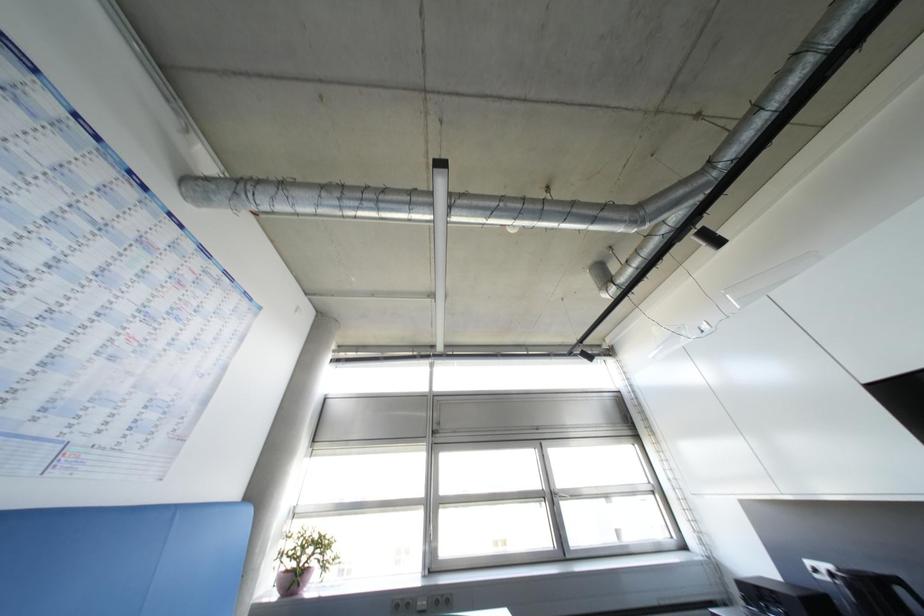
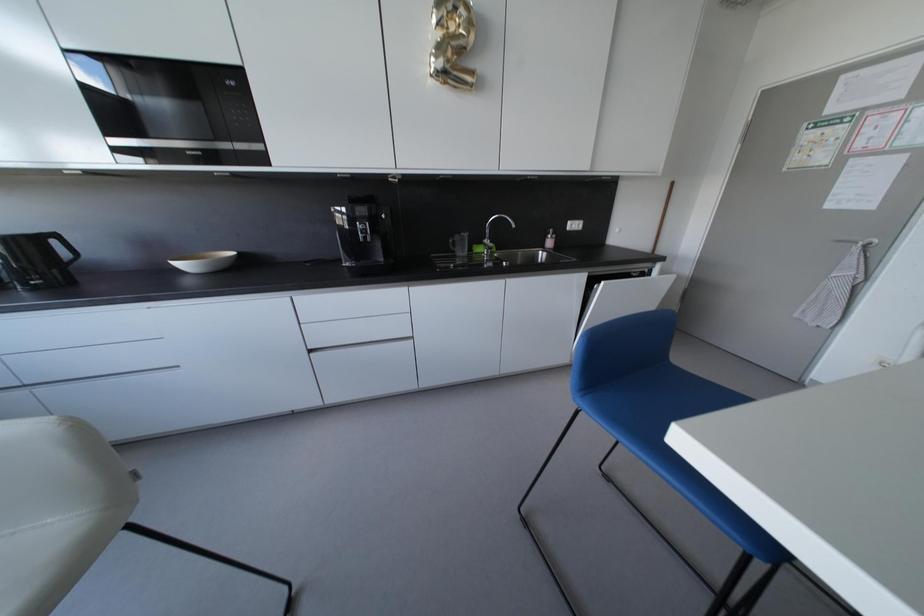
Question: The camera is either moving clockwise (left) or counter-clockwise (right) around the object. The first image is from the beginning of the video and the second image is from the end. Is the camera moving left or right when shooting the video?

Choices:
 (A) Left
 (B) Right

Answer: (A)